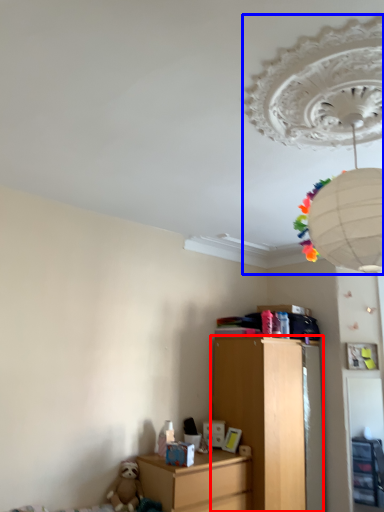
Question: Which of the following is the farthest to the observer, chest of drawers (highlighted by a red box) or lamp (highlighted by a blue box)?

Choices:
 (A) chest of drawers
 (B) lamp

Answer: (A)